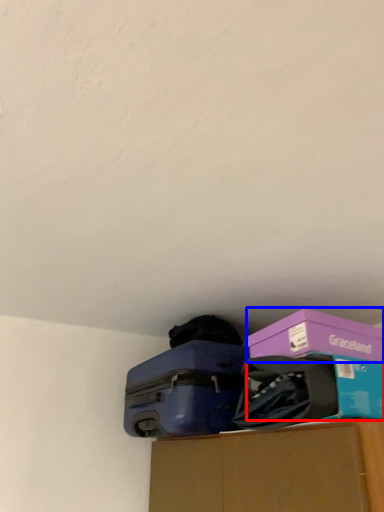
Question: Which of the following is the farthest to the observer, storage box (highlighted by a red box) or box (highlighted by a blue box)?

Choices:
 (A) storage box
 (B) box

Answer: (B)